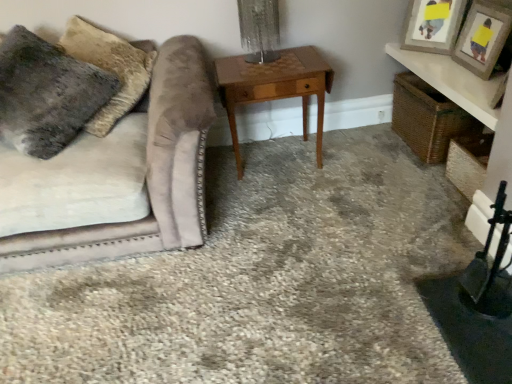
In order to click on vacant area located to the right-hand side of light brown wood table at center in this screenshot , I will do `click(364, 168)`.